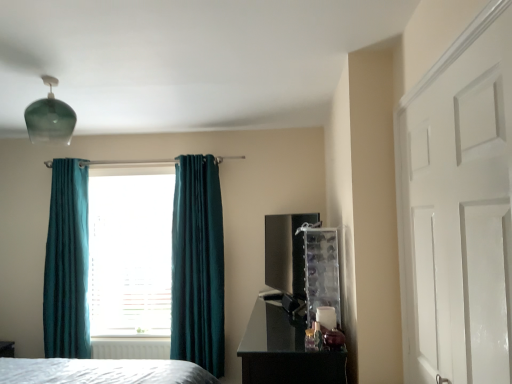
Question: Does glossy black dresser at lower right have a lesser width compared to teal velvet curtain at left, positioned as the second curtain in right-to-left order?

Choices:
 (A) yes
 (B) no

Answer: (B)

Question: Considering the relative sizes of glossy black dresser at lower right and teal velvet curtain at left, positioned as the second curtain in right-to-left order, in the image provided, is glossy black dresser at lower right wider than teal velvet curtain at left, positioned as the second curtain in right-to-left order,?

Choices:
 (A) yes
 (B) no

Answer: (A)

Question: Does glossy black dresser at lower right lie in front of teal velvet curtain at left, positioned as the second curtain in right-to-left order?

Choices:
 (A) no
 (B) yes

Answer: (B)

Question: From a real-world perspective, does glossy black dresser at lower right stand above teal velvet curtain at left, positioned as the second curtain in right-to-left order?

Choices:
 (A) yes
 (B) no

Answer: (B)

Question: Are glossy black dresser at lower right and teal velvet curtain at left, positioned as the second curtain in right-to-left order, located far from each other?

Choices:
 (A) yes
 (B) no

Answer: (A)

Question: Is teal velvet curtain at left, positioned as the second curtain in right-to-left order, completely or partially inside glossy black dresser at lower right?

Choices:
 (A) yes
 (B) no

Answer: (B)

Question: From the image's perspective, is glossy black dresser at lower right over green glass light fixture at upper left?

Choices:
 (A) yes
 (B) no

Answer: (B)

Question: Considering the relative sizes of glossy black dresser at lower right and green glass light fixture at upper left in the image provided, is glossy black dresser at lower right thinner than green glass light fixture at upper left?

Choices:
 (A) no
 (B) yes

Answer: (A)

Question: Considering the relative sizes of glossy black dresser at lower right and green glass light fixture at upper left in the image provided, is glossy black dresser at lower right wider than green glass light fixture at upper left?

Choices:
 (A) no
 (B) yes

Answer: (B)

Question: Is glossy black dresser at lower right surrounding green glass light fixture at upper left?

Choices:
 (A) no
 (B) yes

Answer: (A)

Question: Is glossy black dresser at lower right completely or partially outside of green glass light fixture at upper left?

Choices:
 (A) yes
 (B) no

Answer: (A)

Question: Can you confirm if glossy black dresser at lower right is taller than green glass light fixture at upper left?

Choices:
 (A) no
 (B) yes

Answer: (B)

Question: Is teal velvet curtain at left, the first curtain viewed from the left, at the back of white plastic radiator at lower center?

Choices:
 (A) yes
 (B) no

Answer: (B)